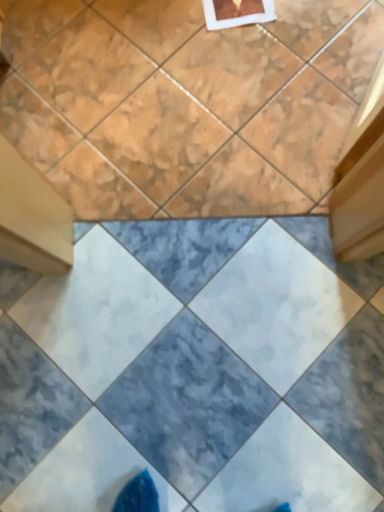
Identify the location of marble tile at upper center, arranged as the 2th ceramic tile when ordered from the bottom. (186, 103).

Measure the distance between marble tile at upper center, arranged as the 2th ceramic tile when ordered from the bottom, and camera.

marble tile at upper center, arranged as the 2th ceramic tile when ordered from the bottom, and camera are 3.86 feet apart from each other.

What do you see at coordinates (186, 103) in the screenshot? The height and width of the screenshot is (512, 384). I see `marble tile at upper center, marked as the 1th ceramic tile in a top-to-bottom arrangement` at bounding box center [186, 103].

What do you see at coordinates (195, 370) in the screenshot? I see `marble-like ceramic tile at center, which ranks as the 1th ceramic tile in bottom-to-top order` at bounding box center [195, 370].

I want to click on marble-like ceramic tile at center, which is counted as the second ceramic tile, starting from the top, so click(x=195, y=370).

Identify the location of marble tile at upper center, arranged as the 2th ceramic tile when ordered from the bottom. [186, 103].

Between marble tile at upper center, marked as the 1th ceramic tile in a top-to-bottom arrangement, and marble-like ceramic tile at center, which ranks as the 1th ceramic tile in bottom-to-top order, which one appears on the right side from the viewer's perspective?

From the viewer's perspective, marble-like ceramic tile at center, which ranks as the 1th ceramic tile in bottom-to-top order, appears more on the right side.

Which object is further away from the camera taking this photo, marble tile at upper center, marked as the 1th ceramic tile in a top-to-bottom arrangement, or marble-like ceramic tile at center, which is counted as the second ceramic tile, starting from the top?

marble tile at upper center, marked as the 1th ceramic tile in a top-to-bottom arrangement.

Which is further, (98, 174) or (256, 389)?

The point (98, 174) is farther from the camera.

From the image's perspective, is marble tile at upper center, arranged as the 2th ceramic tile when ordered from the bottom, located above or below marble-like ceramic tile at center, which is counted as the second ceramic tile, starting from the top?

marble tile at upper center, arranged as the 2th ceramic tile when ordered from the bottom, is situated higher than marble-like ceramic tile at center, which is counted as the second ceramic tile, starting from the top, in the image.

From a real-world perspective, which object rests below the other?

marble-like ceramic tile at center, which ranks as the 1th ceramic tile in bottom-to-top order.

Considering the relative sizes of marble tile at upper center, marked as the 1th ceramic tile in a top-to-bottom arrangement, and marble-like ceramic tile at center, which is counted as the second ceramic tile, starting from the top, in the image provided, is marble tile at upper center, marked as the 1th ceramic tile in a top-to-bottom arrangement, thinner than marble-like ceramic tile at center, which is counted as the second ceramic tile, starting from the top,?

No.

In terms of height, does marble tile at upper center, marked as the 1th ceramic tile in a top-to-bottom arrangement, look taller or shorter compared to marble-like ceramic tile at center, which is counted as the second ceramic tile, starting from the top?

Clearly, marble tile at upper center, marked as the 1th ceramic tile in a top-to-bottom arrangement, is shorter compared to marble-like ceramic tile at center, which is counted as the second ceramic tile, starting from the top.

Based on their sizes in the image, would you say marble tile at upper center, marked as the 1th ceramic tile in a top-to-bottom arrangement, is bigger or smaller than marble-like ceramic tile at center, which is counted as the second ceramic tile, starting from the top?

In the image, marble tile at upper center, marked as the 1th ceramic tile in a top-to-bottom arrangement, appears to be larger than marble-like ceramic tile at center, which is counted as the second ceramic tile, starting from the top.

Can we say marble tile at upper center, arranged as the 2th ceramic tile when ordered from the bottom, lies outside marble-like ceramic tile at center, which ranks as the 1th ceramic tile in bottom-to-top order?

Absolutely, marble tile at upper center, arranged as the 2th ceramic tile when ordered from the bottom, is external to marble-like ceramic tile at center, which ranks as the 1th ceramic tile in bottom-to-top order.

Looking at this image, is marble tile at upper center, marked as the 1th ceramic tile in a top-to-bottom arrangement, beside marble-like ceramic tile at center, which is counted as the second ceramic tile, starting from the top?

marble tile at upper center, marked as the 1th ceramic tile in a top-to-bottom arrangement, and marble-like ceramic tile at center, which is counted as the second ceramic tile, starting from the top, are not in contact.

Is marble tile at upper center, arranged as the 2th ceramic tile when ordered from the bottom, aimed at marble-like ceramic tile at center, which is counted as the second ceramic tile, starting from the top?

Yes, marble tile at upper center, arranged as the 2th ceramic tile when ordered from the bottom, is turned towards marble-like ceramic tile at center, which is counted as the second ceramic tile, starting from the top.

How many degrees apart are the facing directions of marble tile at upper center, marked as the 1th ceramic tile in a top-to-bottom arrangement, and marble-like ceramic tile at center, which is counted as the second ceramic tile, starting from the top?

They differ by 180 degrees in their facing directions.

In order to click on ceramic tile in front of the marble tile at upper center, marked as the 1th ceramic tile in a top-to-bottom arrangement in this screenshot , I will do `click(195, 370)`.

Which object is positioned more to the right, marble-like ceramic tile at center, which ranks as the 1th ceramic tile in bottom-to-top order, or marble tile at upper center, marked as the 1th ceramic tile in a top-to-bottom arrangement?

marble-like ceramic tile at center, which ranks as the 1th ceramic tile in bottom-to-top order.

Which object is further away from the camera, marble-like ceramic tile at center, which ranks as the 1th ceramic tile in bottom-to-top order, or marble tile at upper center, marked as the 1th ceramic tile in a top-to-bottom arrangement?

marble tile at upper center, marked as the 1th ceramic tile in a top-to-bottom arrangement, is more distant.

Is point (1, 448) closer to viewer compared to point (46, 89)?

Yes, it is.

From the image's perspective, which one is positioned higher, marble-like ceramic tile at center, which is counted as the second ceramic tile, starting from the top, or marble tile at upper center, marked as the 1th ceramic tile in a top-to-bottom arrangement?

marble tile at upper center, marked as the 1th ceramic tile in a top-to-bottom arrangement, appears higher in the image.

From a real-world perspective, between marble-like ceramic tile at center, which ranks as the 1th ceramic tile in bottom-to-top order, and marble tile at upper center, arranged as the 2th ceramic tile when ordered from the bottom, who is vertically higher?

From a 3D spatial view, marble tile at upper center, arranged as the 2th ceramic tile when ordered from the bottom, is above.

Is marble-like ceramic tile at center, which is counted as the second ceramic tile, starting from the top, wider than marble tile at upper center, marked as the 1th ceramic tile in a top-to-bottom arrangement?

No, marble-like ceramic tile at center, which is counted as the second ceramic tile, starting from the top, is not wider than marble tile at upper center, marked as the 1th ceramic tile in a top-to-bottom arrangement.

Which of these two, marble-like ceramic tile at center, which ranks as the 1th ceramic tile in bottom-to-top order, or marble tile at upper center, marked as the 1th ceramic tile in a top-to-bottom arrangement, stands shorter?

Standing shorter between the two is marble tile at upper center, marked as the 1th ceramic tile in a top-to-bottom arrangement.

Is marble-like ceramic tile at center, which is counted as the second ceramic tile, starting from the top, bigger than marble tile at upper center, arranged as the 2th ceramic tile when ordered from the bottom?

Incorrect, marble-like ceramic tile at center, which is counted as the second ceramic tile, starting from the top, is not larger than marble tile at upper center, arranged as the 2th ceramic tile when ordered from the bottom.

Do you think marble-like ceramic tile at center, which ranks as the 1th ceramic tile in bottom-to-top order, is within marble tile at upper center, marked as the 1th ceramic tile in a top-to-bottom arrangement, or outside of it?

marble-like ceramic tile at center, which ranks as the 1th ceramic tile in bottom-to-top order, cannot be found inside marble tile at upper center, marked as the 1th ceramic tile in a top-to-bottom arrangement.

From the picture: Is marble-like ceramic tile at center, which is counted as the second ceramic tile, starting from the top, not near marble tile at upper center, arranged as the 2th ceramic tile when ordered from the bottom?

No, there isn't a large distance between marble-like ceramic tile at center, which is counted as the second ceramic tile, starting from the top, and marble tile at upper center, arranged as the 2th ceramic tile when ordered from the bottom.

Could you tell me if marble-like ceramic tile at center, which ranks as the 1th ceramic tile in bottom-to-top order, is facing marble tile at upper center, arranged as the 2th ceramic tile when ordered from the bottom?

Yes, marble-like ceramic tile at center, which ranks as the 1th ceramic tile in bottom-to-top order, faces towards marble tile at upper center, arranged as the 2th ceramic tile when ordered from the bottom.

The width and height of the screenshot is (384, 512). I want to click on ceramic tile located in front of the marble tile at upper center, marked as the 1th ceramic tile in a top-to-bottom arrangement, so click(195, 370).

Find the location of a particular element. This screenshot has height=512, width=384. ceramic tile that appears in front of the marble tile at upper center, marked as the 1th ceramic tile in a top-to-bottom arrangement is located at coordinates (195, 370).

Find the location of `ceramic tile located underneath the marble tile at upper center, arranged as the 2th ceramic tile when ordered from the bottom (from a real-world perspective)`. ceramic tile located underneath the marble tile at upper center, arranged as the 2th ceramic tile when ordered from the bottom (from a real-world perspective) is located at coordinates (195, 370).